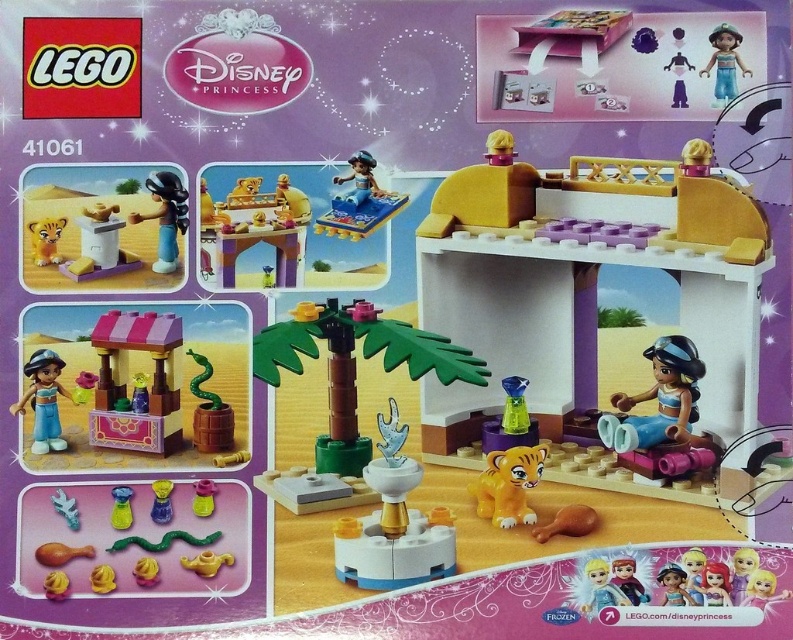
Based on the photo, you are arranging a display in a store and need to place the smooth yellow table at upper center and the brown matte bone at lower center. According to the scene, which object is positioned to the left of the other?

The smooth yellow table at upper center is to the left of the brown matte bone at lower center.

You are a LEGO designer who needs to place a new accessory in the LEGO Disney Princess set. You have two vases available, the translucent yellow vase at lower left and the matte blue vase at lower left. Which vase can you place a taller flower arrangement in without it looking out of scale?

The translucent yellow vase at lower left has a larger size compared to the matte blue vase at lower left, so it can accommodate a taller flower arrangement without appearing out of scale.

You are standing in front of the LEGO set 41061. You want to place a small toy that is 3 feet long between the matte orange tiger at left and the edge of the packaging. Is there enough space?

The matte orange tiger at left is 4.17 feet away from the viewer. Since the toy is 3 feet long, there is enough space between the tiger and the edge of the packaging to place it.